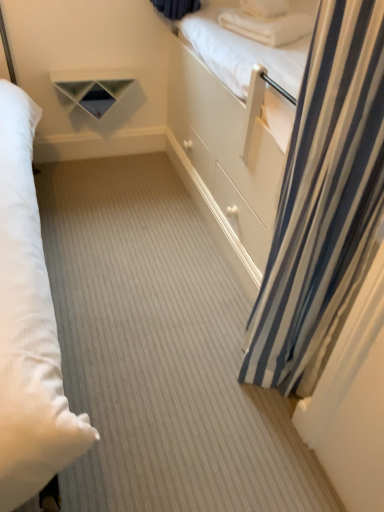
Question: Can white matte shelf at upper center be found inside white soft pillow at upper right, the 2th pillow in the top-to-bottom sequence?

Choices:
 (A) no
 (B) yes

Answer: (A)

Question: Is white soft pillow at upper right, which ranks as the 1th pillow in bottom-to-top order, bigger than white matte shelf at upper center?

Choices:
 (A) no
 (B) yes

Answer: (A)

Question: Does white soft pillow at upper right, the 2th pillow in the top-to-bottom sequence, have a lesser width compared to white matte shelf at upper center?

Choices:
 (A) yes
 (B) no

Answer: (B)

Question: From the image's perspective, does white soft pillow at upper right, which ranks as the 1th pillow in bottom-to-top order, appear lower than white matte shelf at upper center?

Choices:
 (A) no
 (B) yes

Answer: (A)

Question: Is white soft pillow at upper right, the 2th pillow in the top-to-bottom sequence, wider than white matte shelf at upper center?

Choices:
 (A) yes
 (B) no

Answer: (A)

Question: Is blue striped curtain at right bigger than white soft pillow at upper right, which appears as the second pillow when ordered from the bottom?

Choices:
 (A) yes
 (B) no

Answer: (A)

Question: From the image's perspective, is blue striped curtain at right on top of white soft pillow at upper right, acting as the first pillow starting from the top?

Choices:
 (A) yes
 (B) no

Answer: (B)

Question: Is blue striped curtain at right not within white soft pillow at upper right, acting as the first pillow starting from the top?

Choices:
 (A) no
 (B) yes

Answer: (B)

Question: Is blue striped curtain at right turned away from white soft pillow at upper right, acting as the first pillow starting from the top?

Choices:
 (A) no
 (B) yes

Answer: (A)

Question: Is the depth of blue striped curtain at right greater than that of white soft pillow at upper right, which appears as the second pillow when ordered from the bottom?

Choices:
 (A) no
 (B) yes

Answer: (A)

Question: Does blue striped curtain at right have a greater width compared to white soft pillow at upper right, which appears as the second pillow when ordered from the bottom?

Choices:
 (A) no
 (B) yes

Answer: (B)

Question: Can you confirm if blue striped curtain at right is positioned to the left of white matte shelf at upper center?

Choices:
 (A) yes
 (B) no

Answer: (B)